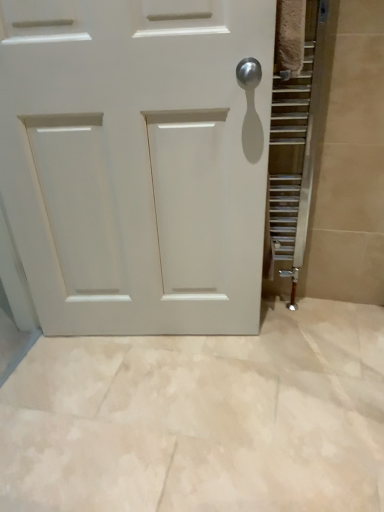
The height and width of the screenshot is (512, 384). I want to click on blank area beneath white matte door at center (from a real-world perspective), so click(x=153, y=339).